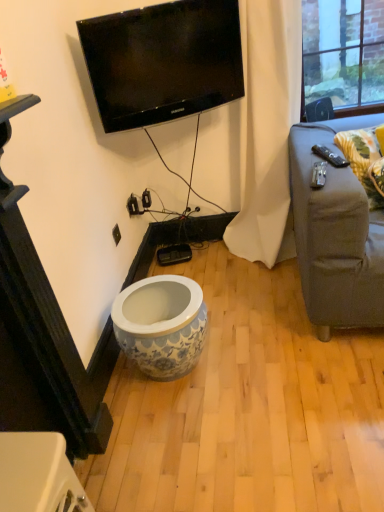
Question: Is yellow floral fabric pillow at right wider than white fabric curtain at center?

Choices:
 (A) yes
 (B) no

Answer: (B)

Question: Does yellow floral fabric pillow at right appear on the right side of white fabric curtain at center?

Choices:
 (A) yes
 (B) no

Answer: (A)

Question: Considering the relative sizes of yellow floral fabric pillow at right and white fabric curtain at center in the image provided, is yellow floral fabric pillow at right bigger than white fabric curtain at center?

Choices:
 (A) yes
 (B) no

Answer: (B)

Question: Can you confirm if yellow floral fabric pillow at right is taller than white fabric curtain at center?

Choices:
 (A) no
 (B) yes

Answer: (A)

Question: Is yellow floral fabric pillow at right closer to the viewer compared to white fabric curtain at center?

Choices:
 (A) no
 (B) yes

Answer: (A)

Question: Can we say yellow floral fabric pillow at right lies outside white fabric curtain at center?

Choices:
 (A) yes
 (B) no

Answer: (A)

Question: Can you confirm if black glossy tv at upper center is smaller than yellow floral fabric pillow at right?

Choices:
 (A) no
 (B) yes

Answer: (A)

Question: Would you say black glossy tv at upper center is outside yellow floral fabric pillow at right?

Choices:
 (A) no
 (B) yes

Answer: (B)

Question: Does black glossy tv at upper center have a greater height compared to yellow floral fabric pillow at right?

Choices:
 (A) yes
 (B) no

Answer: (A)

Question: Is black glossy tv at upper center to the right of yellow floral fabric pillow at right from the viewer's perspective?

Choices:
 (A) yes
 (B) no

Answer: (B)

Question: Is black glossy tv at upper center looking in the opposite direction of yellow floral fabric pillow at right?

Choices:
 (A) yes
 (B) no

Answer: (B)

Question: Is black glossy tv at upper center oriented towards yellow floral fabric pillow at right?

Choices:
 (A) yes
 (B) no

Answer: (B)

Question: Is white fabric curtain at center thinner than yellow floral fabric pillow at right?

Choices:
 (A) no
 (B) yes

Answer: (A)